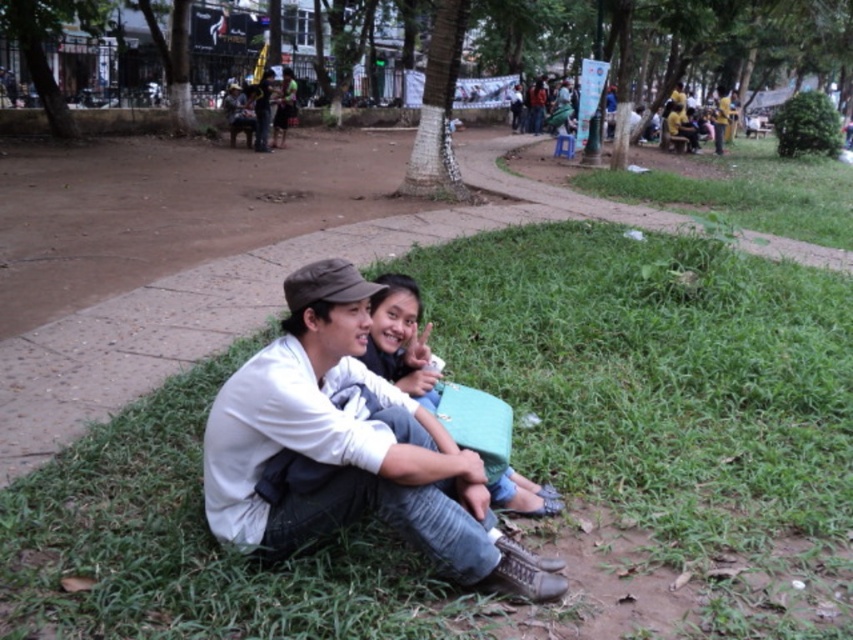
Is white matte shirt at center thinner than matte green bag at center?

No, white matte shirt at center is not thinner than matte green bag at center.

The width and height of the screenshot is (853, 640). What are the coordinates of `white matte shirt at center` in the screenshot? It's located at (349, 451).

Identify the location of white matte shirt at center. (349, 451).

Where is `green grass at lower center`? This screenshot has height=640, width=853. green grass at lower center is located at coordinates (671, 404).

Is green grass at lower center wider than matte green bag at center?

Indeed, green grass at lower center has a greater width compared to matte green bag at center.

Does point (57, 621) lie behind point (425, 385)?

No, (57, 621) is in front of (425, 385).

You are a GUI agent. You are given a task and a screenshot of the screen. Output one action in this format:
    pyautogui.click(x=<x>, y=<y>)
    Task: Click on the green grass at lower center
    The image size is (853, 640).
    Given the screenshot: What is the action you would take?
    pyautogui.click(x=671, y=404)

Between green grass at lower center and white matte shirt at center, which one appears on the left side from the viewer's perspective?

white matte shirt at center

Between point (759, 476) and point (283, 284), which one is positioned in front?

Point (759, 476) is more forward.

I want to click on green grass at lower center, so click(x=671, y=404).